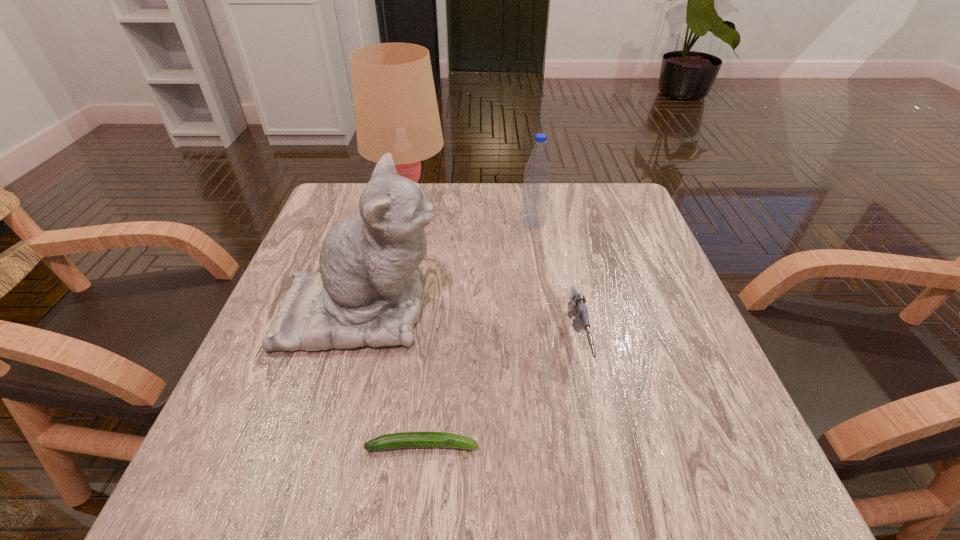
You are a GUI agent. You are given a task and a screenshot of the screen. Output one action in this format:
    pyautogui.click(x=<x>, y=<y>)
    Task: Click on the vacant space situated on the front of the fourth object from left to right
    The height and width of the screenshot is (540, 960).
    Given the screenshot: What is the action you would take?
    pyautogui.click(x=540, y=266)

Find the location of a particular element. The height and width of the screenshot is (540, 960). vacant space positioned at the barrel of the rightmost object is located at coordinates (591, 417).

You are a GUI agent. You are given a task and a screenshot of the screen. Output one action in this format:
    pyautogui.click(x=<x>, y=<y>)
    Task: Click on the free region located 0.110m on the front-facing side of the nearest object
    The height and width of the screenshot is (540, 960).
    Given the screenshot: What is the action you would take?
    click(x=550, y=445)

Find the location of a particular element. The width and height of the screenshot is (960, 540). lampshade that is positioned at the far edge is located at coordinates pyautogui.click(x=396, y=111).

The width and height of the screenshot is (960, 540). Find the location of `water bottle positioned at the far edge`. water bottle positioned at the far edge is located at coordinates (535, 192).

Locate an element on the screen. Image resolution: width=960 pixels, height=540 pixels. object that is at the near edge is located at coordinates (405, 439).

This screenshot has height=540, width=960. In order to click on lampshade at the left edge in this screenshot , I will do `click(396, 111)`.

The width and height of the screenshot is (960, 540). What are the coordinates of `cat present at the left edge` in the screenshot? It's located at (368, 292).

Where is `object located at the far left corner`? The width and height of the screenshot is (960, 540). object located at the far left corner is located at coordinates (396, 111).

Find the location of a particular element. blank space at the far edge of the desktop is located at coordinates (430, 225).